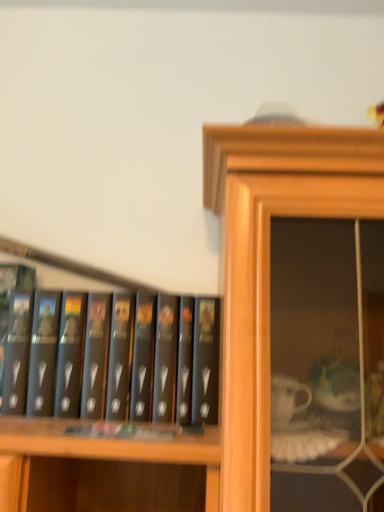
This screenshot has height=512, width=384. In order to click on free space above black matte bookshelf at center (from a real-world perspective) in this screenshot , I will do `click(86, 286)`.